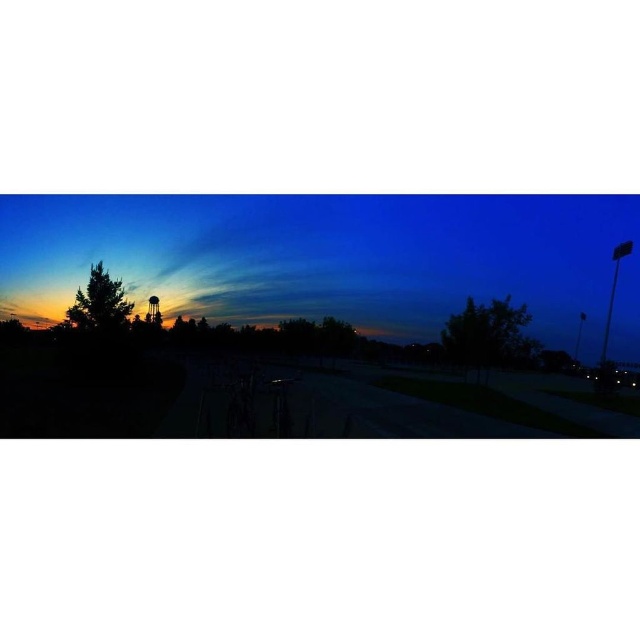
You are an astronomer analyzing the twilight scene. You have a telescope with a 10 cm diameter lens. You want to observe the silhouette trees at left. The point you need to focus on is at coordinates point (333, 260). Is this point within the observable area of the telescope?

The point (333, 260) corresponds to the silhouette trees at left, so yes, the telescope can observe this point as it aligns with the trees.

You are an artist trying to paint the twilight scene. You notice two trees in the foreground. Which tree, the green leafy tree at center or the green matte tree at left, should you depict as having a broader spread in your painting?

The green leafy tree at center should be depicted as having a broader spread since it might be wider than the green matte tree at left according to the description.